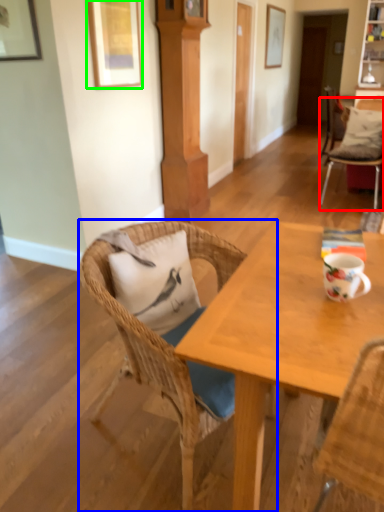
Question: Considering the real-world distances, which object is closest to chair (highlighted by a red box)? chair (highlighted by a blue box) or picture frame (highlighted by a green box).

Choices:
 (A) chair
 (B) picture frame

Answer: (B)